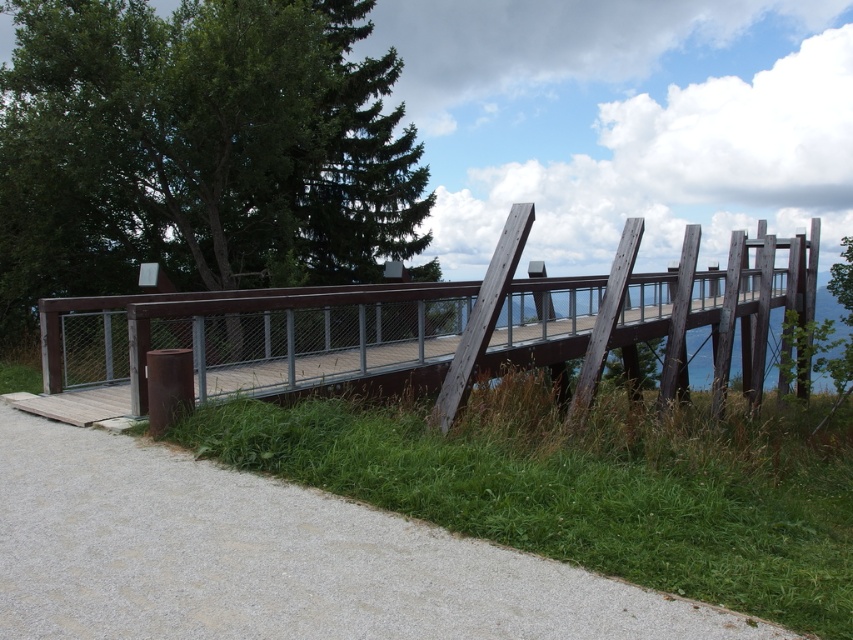
You are a landscape architect designing a garden. You have a limited amount of gravel and need to decide where to place it. Based on the image, which area has more space available for placing gravel between the gravel at lower left and the brown wooden bridge at center?

The brown wooden bridge at center occupies more space than the gravel at lower left, so the area around the brown wooden bridge at center has more space available for placing gravel.

You are standing at the point marked as point (477, 608) on the wooden bridge. You want to walk to the entrance of the bridge that leads to the paved pathway. Is the entrance closer to you or farther away than 12 feet?

The distance between point (477, 608) and the viewer is 11.06 feet, so the entrance is closer than 12 feet away.

You are standing at the entrance of the bridge and see gravel at lower left located at point (273, 557). If you want to walk towards the gravel at lower left, which direction should you move relative to the bridge?

The gravel at lower left is located at point (273, 557), so you should move towards the lower left direction relative to the bridge.